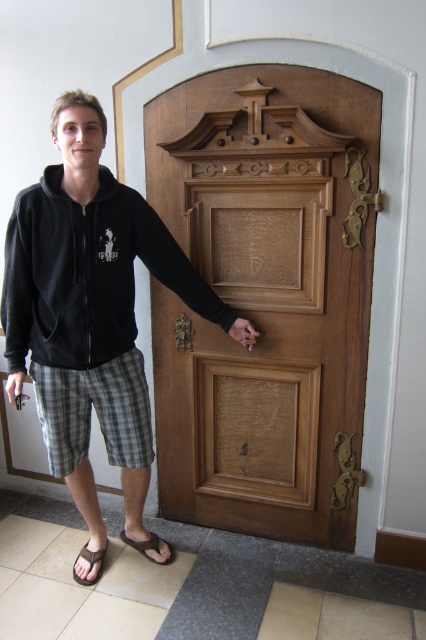
Question: Does wooden carved door at center have a larger size compared to black rubber sandal at lower left?

Choices:
 (A) no
 (B) yes

Answer: (B)

Question: Estimate the real-world distances between objects in this image. Which object is closer to the black rubber sandal at lower left?

Choices:
 (A) wooden carved door at center
 (B) black fleece sweatshirt at left
 (C) black cotton hoodie at center

Answer: (C)

Question: Which object is the closest to the black cotton hoodie at center?

Choices:
 (A) brown leather sandal at lower left
 (B) wooden carved door at center
 (C) black rubber sandal at lower left

Answer: (B)

Question: Where is brown leather sandal at lower left located in relation to black rubber sandal at lower left in the image?

Choices:
 (A) right
 (B) left

Answer: (A)

Question: Is black cotton hoodie at center positioned behind brown leather sandal at lower left?

Choices:
 (A) yes
 (B) no

Answer: (B)

Question: Which point is closer to the camera?

Choices:
 (A) black fleece sweatshirt at left
 (B) wooden carved door at center
 (C) black cotton hoodie at center
 (D) black rubber sandal at lower left

Answer: (C)